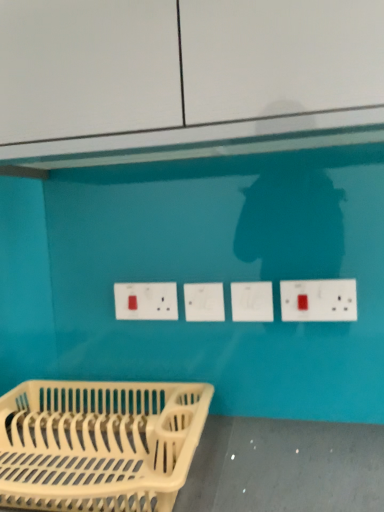
The width and height of the screenshot is (384, 512). What do you see at coordinates (252, 301) in the screenshot?
I see `white plastic socket at center, the 1th socket viewed from the right` at bounding box center [252, 301].

This screenshot has width=384, height=512. What do you see at coordinates (318, 300) in the screenshot?
I see `white plastic electric outlet at right, positioned as the first electric outlet in right-to-left order` at bounding box center [318, 300].

Find the location of a particular element. This screenshot has height=512, width=384. white plastic socket at center, which is the 2th socket in left-to-right order is located at coordinates (252, 301).

Which is more to the left, white plastic socket at center, the 1th socket viewed from the right, or white plastic electric outlet at right, positioned as the first electric outlet in right-to-left order?

white plastic socket at center, the 1th socket viewed from the right.

Can you confirm if white plastic socket at center, the 1th socket viewed from the right, is taller than white plastic electric outlet at right, the 2th electric outlet viewed from the back?

Incorrect, the height of white plastic socket at center, the 1th socket viewed from the right, is not larger of that of white plastic electric outlet at right, the 2th electric outlet viewed from the back.

Is white plastic socket at center, the 1th socket viewed from the right, positioned beyond the bounds of white plastic electric outlet at right, the first electric outlet viewed from the front?

That's correct, white plastic socket at center, the 1th socket viewed from the right, is outside of white plastic electric outlet at right, the first electric outlet viewed from the front.

Is white plastic socket at center, which is the 2th socket in left-to-right order, facing towards white plastic electric outlet at right, the first electric outlet viewed from the front?

No.

Which is closer to the camera, (x=211, y=319) or (x=312, y=317)?

Point (x=211, y=319) is farther from the camera than point (x=312, y=317).

The image size is (384, 512). What are the coordinates of `socket that is the 2nd one when counting backward from the white plastic electric outlet at right, the 2th electric outlet viewed from the back` in the screenshot? It's located at (204, 302).

Which object is thinner, white plastic socket at center, the 2th socket positioned from the right, or white plastic electric outlet at right, positioned as the first electric outlet in right-to-left order?

With smaller width is white plastic electric outlet at right, positioned as the first electric outlet in right-to-left order.

Is white plastic electric outlet at right, positioned as the first electric outlet in right-to-left order, at the back of white plastic socket at center, arranged as the 1th socket when viewed from the left?

white plastic socket at center, arranged as the 1th socket when viewed from the left, does not have its back to white plastic electric outlet at right, positioned as the first electric outlet in right-to-left order.

Is white plastic electrical outlet at center, the 1th electric outlet when ordered from left to right, at the right side of white plastic electric outlet at right, the second electric outlet viewed from the left?

Incorrect, white plastic electrical outlet at center, the 1th electric outlet when ordered from left to right, is not on the right side of white plastic electric outlet at right, the second electric outlet viewed from the left.

Is white plastic electric outlet at right, the second electric outlet viewed from the left, at the back of white plastic electrical outlet at center, marked as the second electric outlet in a right-to-left arrangement?

No, white plastic electrical outlet at center, marked as the second electric outlet in a right-to-left arrangement,'s orientation is not away from white plastic electric outlet at right, the second electric outlet viewed from the left.

Is white plastic electrical outlet at center, placed as the second electric outlet when sorted from front to back, thinner than white plastic electric outlet at right, positioned as the first electric outlet in right-to-left order?

No, white plastic electrical outlet at center, placed as the second electric outlet when sorted from front to back, is not thinner than white plastic electric outlet at right, positioned as the first electric outlet in right-to-left order.

Considering the positions of point (149, 315) and point (336, 312), is point (149, 315) closer or farther from the camera than point (336, 312)?

Clearly, point (149, 315) is more distant from the camera than point (336, 312).

Considering the positions of objects white plastic dish rack at lower left and white plastic electric outlet at right, the second electric outlet viewed from the left, in the image provided, who is behind, white plastic dish rack at lower left or white plastic electric outlet at right, the second electric outlet viewed from the left,?

white plastic electric outlet at right, the second electric outlet viewed from the left.

Considering the relative positions of white plastic dish rack at lower left and white plastic electric outlet at right, the 2th electric outlet viewed from the back, in the image provided, is white plastic dish rack at lower left to the right of white plastic electric outlet at right, the 2th electric outlet viewed from the back, from the viewer's perspective?

Incorrect, white plastic dish rack at lower left is not on the right side of white plastic electric outlet at right, the 2th electric outlet viewed from the back.

From the picture: From a real-world perspective, is white plastic dish rack at lower left physically above white plastic electric outlet at right, positioned as the first electric outlet in right-to-left order?

No, from a real-world perspective, white plastic dish rack at lower left is not above white plastic electric outlet at right, positioned as the first electric outlet in right-to-left order.

Is white plastic dish rack at lower left situated inside white plastic electric outlet at right, the first electric outlet viewed from the front, or outside?

white plastic dish rack at lower left is spatially situated outside white plastic electric outlet at right, the first electric outlet viewed from the front.

Does white plastic socket at center, arranged as the 1th socket when viewed from the left, come in front of white plastic dish rack at lower left?

No, it is behind white plastic dish rack at lower left.

Considering the sizes of objects white plastic socket at center, arranged as the 1th socket when viewed from the left, and white plastic dish rack at lower left in the image provided, who is thinner, white plastic socket at center, arranged as the 1th socket when viewed from the left, or white plastic dish rack at lower left?

white plastic socket at center, arranged as the 1th socket when viewed from the left, is thinner.

Can you tell me how much white plastic socket at center, the 2th socket positioned from the right, and white plastic dish rack at lower left differ in facing direction?

The angle between the facing direction of white plastic socket at center, the 2th socket positioned from the right, and the facing direction of white plastic dish rack at lower left is 1.86 degrees.

From a real-world perspective, who is located higher, white plastic socket at center, arranged as the 1th socket when viewed from the left, or white plastic dish rack at lower left?

In real-world perspective, white plastic socket at center, arranged as the 1th socket when viewed from the left, is above.

Does point (194, 319) appear closer or farther from the camera than point (269, 320)?

Point (194, 319).

Would you say white plastic socket at center, arranged as the 1th socket when viewed from the left, is inside or outside white plastic socket at center, the 1th socket viewed from the right?

The correct answer is: outside.

Who is taller, white plastic socket at center, the 2th socket positioned from the right, or white plastic socket at center, which is the 2th socket in left-to-right order?

Standing taller between the two is white plastic socket at center, the 2th socket positioned from the right.

Is the position of white plastic socket at center, arranged as the 1th socket when viewed from the left, more distant than that of white plastic socket at center, the 1th socket viewed from the right?

That is True.

Considering the relative sizes of white plastic socket at center, the 1th socket viewed from the right, and white plastic dish rack at lower left in the image provided, is white plastic socket at center, the 1th socket viewed from the right, bigger than white plastic dish rack at lower left?

No, white plastic socket at center, the 1th socket viewed from the right, is not bigger than white plastic dish rack at lower left.

Can you confirm if white plastic socket at center, which is the 2th socket in left-to-right order, is thinner than white plastic dish rack at lower left?

Indeed, white plastic socket at center, which is the 2th socket in left-to-right order, has a lesser width compared to white plastic dish rack at lower left.

Locate an element on the screen. The height and width of the screenshot is (512, 384). furniture that is below the white plastic socket at center, the 1th socket viewed from the right (from the image's perspective) is located at coordinates (99, 444).

Is white plastic socket at center, the 1th socket viewed from the right, far away from white plastic dish rack at lower left?

white plastic socket at center, the 1th socket viewed from the right, is actually quite close to white plastic dish rack at lower left.

You are a GUI agent. You are given a task and a screenshot of the screen. Output one action in this format:
    pyautogui.click(x=<x>, y=<y>)
    Task: Click on the electric outlet that appears on the right of white plastic socket at center, the 1th socket viewed from the right
    This screenshot has height=512, width=384.
    Given the screenshot: What is the action you would take?
    pyautogui.click(x=318, y=300)

Starting from the white plastic electric outlet at right, the second electric outlet viewed from the left, which socket is the 2nd one to the left? Please provide its 2D coordinates.

[(204, 302)]

From the picture: When comparing their distances from white plastic dish rack at lower left, does white plastic electric outlet at right, the second electric outlet viewed from the left, or white plastic socket at center, the 2th socket positioned from the right, seem closer?

The object closer to white plastic dish rack at lower left is white plastic socket at center, the 2th socket positioned from the right.

When comparing their distances from white plastic electrical outlet at center, placed as the second electric outlet when sorted from front to back, does white plastic dish rack at lower left or white plastic socket at center, arranged as the 1th socket when viewed from the left, seem closer?

Among the two, white plastic socket at center, arranged as the 1th socket when viewed from the left, is located nearer to white plastic electrical outlet at center, placed as the second electric outlet when sorted from front to back.

Considering their positions, is white plastic socket at center, which is the 2th socket in left-to-right order, positioned closer to white plastic socket at center, arranged as the 1th socket when viewed from the left, than white plastic electric outlet at right, positioned as the first electric outlet in right-to-left order?

The object closer to white plastic socket at center, arranged as the 1th socket when viewed from the left, is white plastic socket at center, which is the 2th socket in left-to-right order.

Considering their positions, is white plastic electric outlet at right, positioned as the first electric outlet in right-to-left order, positioned closer to white plastic socket at center, the 1th socket viewed from the right, than white plastic socket at center, the 2th socket positioned from the right?

The object closer to white plastic socket at center, the 1th socket viewed from the right, is white plastic socket at center, the 2th socket positioned from the right.

Considering their positions, is white plastic socket at center, the 1th socket viewed from the right, positioned further to white plastic electrical outlet at center, marked as the second electric outlet in a right-to-left arrangement, than white plastic dish rack at lower left?

white plastic dish rack at lower left is positioned further to the anchor white plastic electrical outlet at center, marked as the second electric outlet in a right-to-left arrangement.

Considering their positions, is white plastic electric outlet at right, positioned as the first electric outlet in right-to-left order, positioned closer to white plastic dish rack at lower left than white plastic electrical outlet at center, which is the first electric outlet in back-to-front order?

The object closer to white plastic dish rack at lower left is white plastic electrical outlet at center, which is the first electric outlet in back-to-front order.

Which object lies further to the anchor point white plastic socket at center, which is the 2th socket in left-to-right order, white plastic socket at center, the 2th socket positioned from the right, or white plastic dish rack at lower left?

white plastic dish rack at lower left.

From the image, which object appears to be nearer to white plastic electrical outlet at center, the 1th electric outlet when ordered from left to right, white plastic electric outlet at right, the first electric outlet viewed from the front, or white plastic dish rack at lower left?

Based on the image, white plastic dish rack at lower left appears to be nearer to white plastic electrical outlet at center, the 1th electric outlet when ordered from left to right.

Identify the location of socket between white plastic electrical outlet at center, placed as the second electric outlet when sorted from front to back, and white plastic socket at center, the 1th socket viewed from the right, from left to right. Image resolution: width=384 pixels, height=512 pixels. (204, 302).

Identify the location of socket between white plastic socket at center, the 2th socket positioned from the right, and white plastic electric outlet at right, positioned as the first electric outlet in right-to-left order. (252, 301).

This screenshot has width=384, height=512. In order to click on electric outlet between white plastic dish rack at lower left and white plastic electric outlet at right, the 2th electric outlet viewed from the back in this screenshot , I will do `click(146, 301)`.

This screenshot has height=512, width=384. Find the location of `socket between white plastic dish rack at lower left and white plastic socket at center, arranged as the 1th socket when viewed from the left, from front to back`. socket between white plastic dish rack at lower left and white plastic socket at center, arranged as the 1th socket when viewed from the left, from front to back is located at coordinates (252, 301).